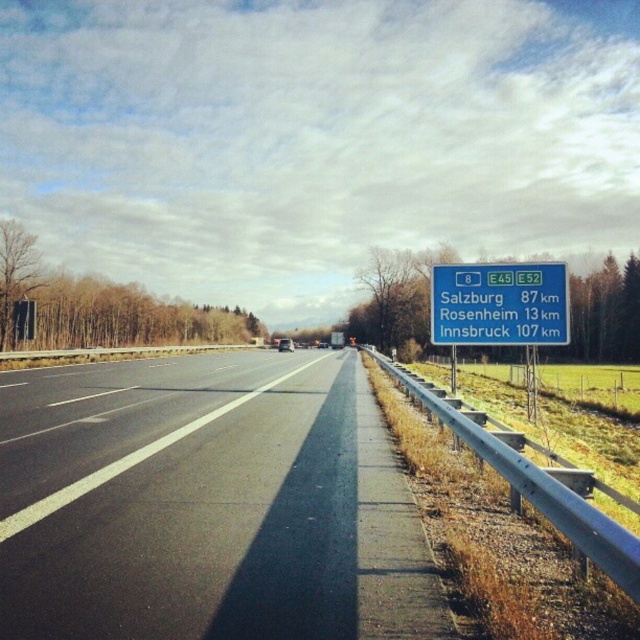
Question: Which of the following is the closest to the observer?

Choices:
 (A) green plastic sign at right
 (B) black asphalt highway at center

Answer: (B)

Question: Among these objects, which one is nearest to the camera?

Choices:
 (A) black asphalt highway at center
 (B) green plastic sign at right

Answer: (A)

Question: Is black asphalt highway at center wider than green plastic sign at right?

Choices:
 (A) yes
 (B) no

Answer: (A)

Question: Which of the following is the closest to the observer?

Choices:
 (A) (120, 406)
 (B) (509, 332)

Answer: (A)

Question: Is black asphalt highway at center closer to camera compared to green plastic sign at right?

Choices:
 (A) no
 (B) yes

Answer: (B)

Question: Is black asphalt highway at center below green plastic sign at right?

Choices:
 (A) no
 (B) yes

Answer: (B)